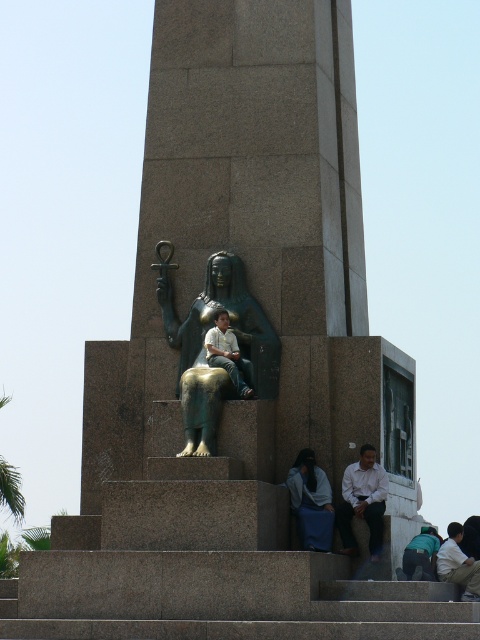
Is white shirt at lower right further to the viewer compared to teal fabric backpack at lower right?

No, white shirt at lower right is closer to the viewer.

The image size is (480, 640). Find the location of `white shirt at lower right`. white shirt at lower right is located at coordinates (362, 500).

Who is higher up, blue fabric at lower center or teal fabric backpack at lower right?

blue fabric at lower center

Is blue fabric at lower center positioned at the back of teal fabric backpack at lower right?

No.

Who is more distant from viewer, (321, 480) or (420, 579)?

The point (420, 579) is behind.

I want to click on blue fabric at lower center, so click(311, 500).

Can you confirm if white shirt at lower right is shorter than matte green statue at center?

Incorrect, white shirt at lower right's height does not fall short of matte green statue at center's.

Can you confirm if white shirt at lower right is positioned below matte green statue at center?

Correct, white shirt at lower right is located below matte green statue at center.

Does point (379, 538) come closer to viewer compared to point (228, 371)?

That is False.

Locate an element on the screen. white shirt at lower right is located at coordinates (362, 500).